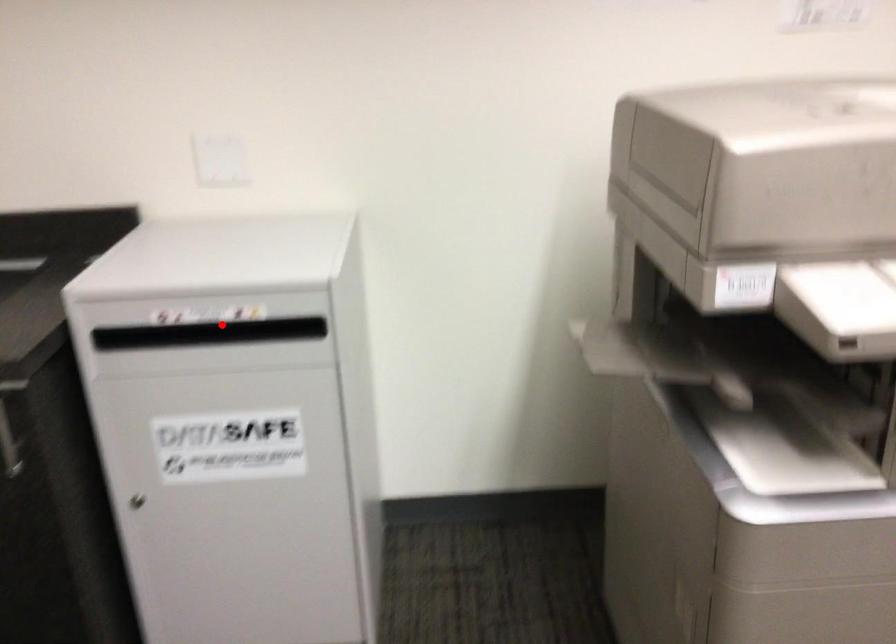
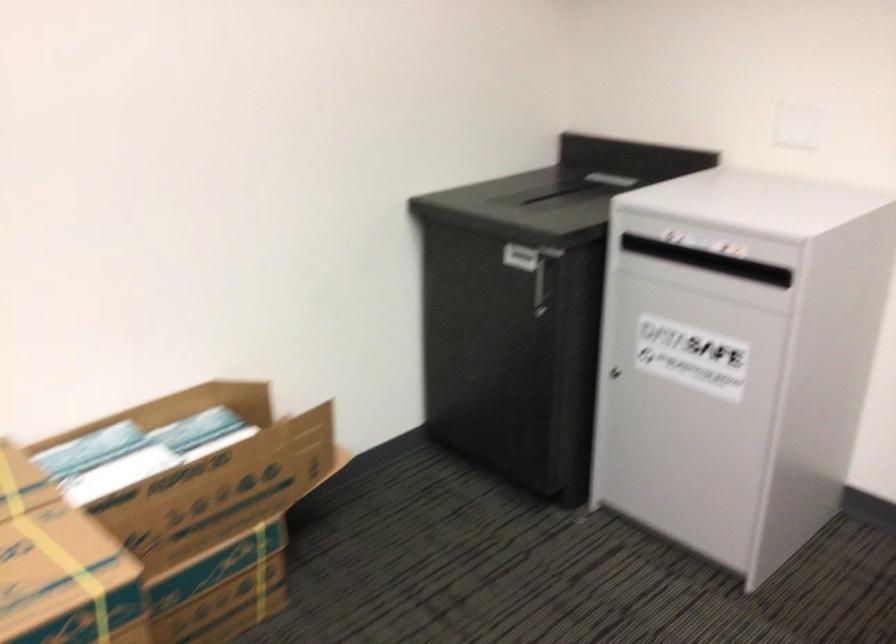
The point at the highlighted location is marked in the first image. Where is the corresponding point in the second image?

(748, 269)